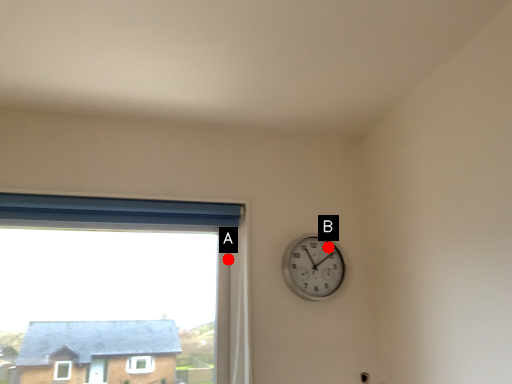
Question: Two points are circled on the image, labeled by A and B beside each circle. Which point is further to the camera?

Choices:
 (A) A is further
 (B) B is further

Answer: (B)